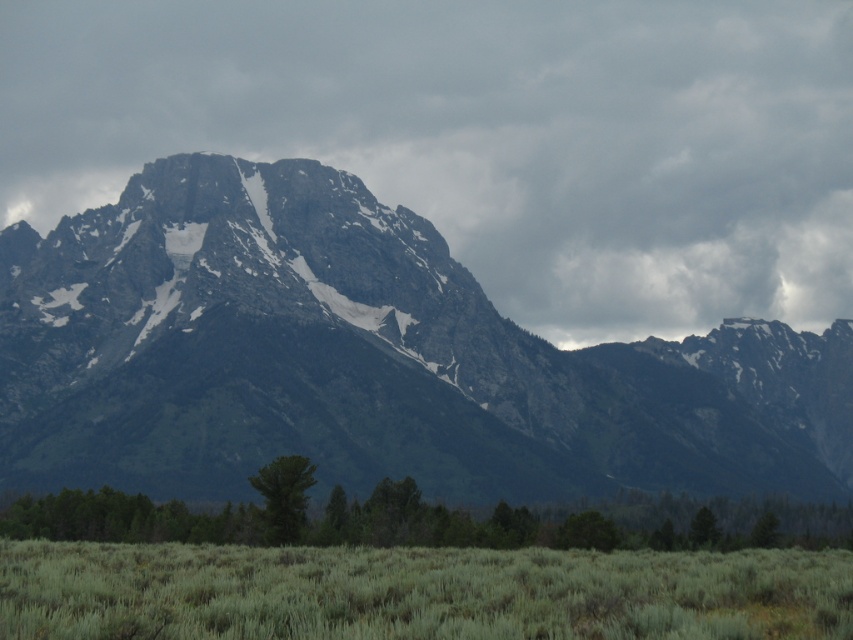
You are a hiker standing at the base of the mountain and want to reach the green grassy field at lower center. There is a green leafy tree at lower center blocking your path. Which direction should you move to go around the tree and reach the field?

The green grassy field at lower center is to the right of the green leafy tree at lower center, so you should move to the right side of the tree to reach the field.

You are standing at the base of the mountain in the image and want to reach the two points marked. Which point, point (701, 364) or point (15, 536), is closer to you?

Point (701, 364) is closer to you because it is further to the viewer than point (15, 536).

You are planning to set up a tent in the green grassy field at lower center. However, you are concerned about visibility. Will the green leafy tree at lower center block your view of the mountains in the background?

The green grassy field at lower center is not as tall as the green leafy tree at lower center, so the tree might block your view of the mountains depending on its height and position.